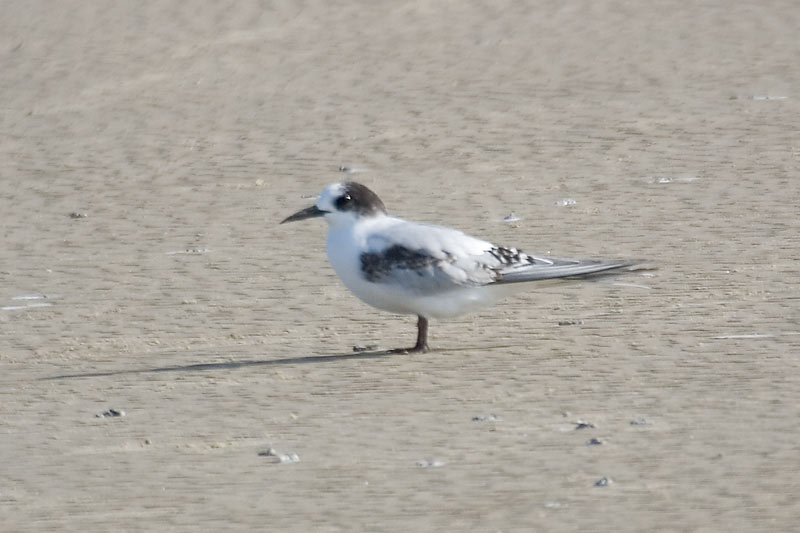
Identify the location of chest. The width and height of the screenshot is (800, 533). (350, 250).